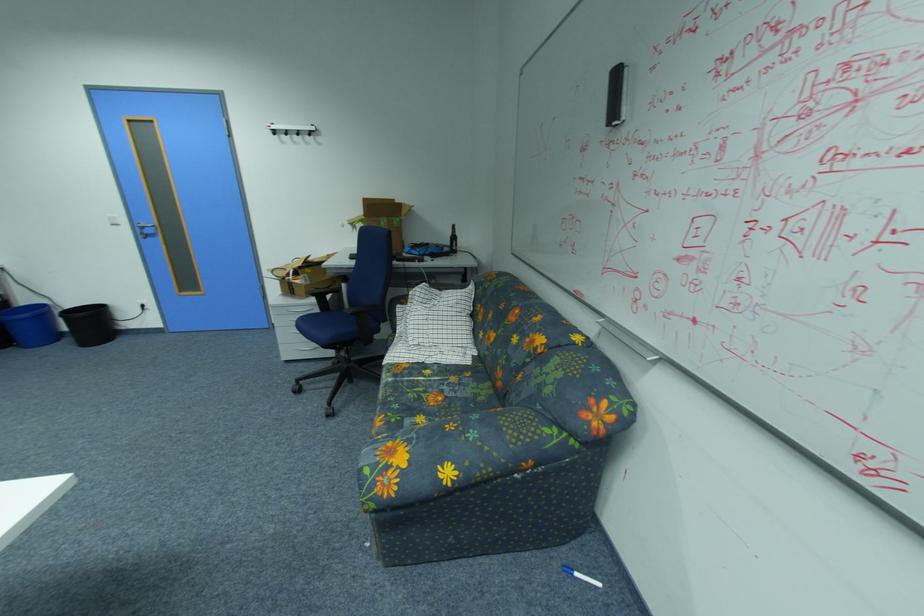
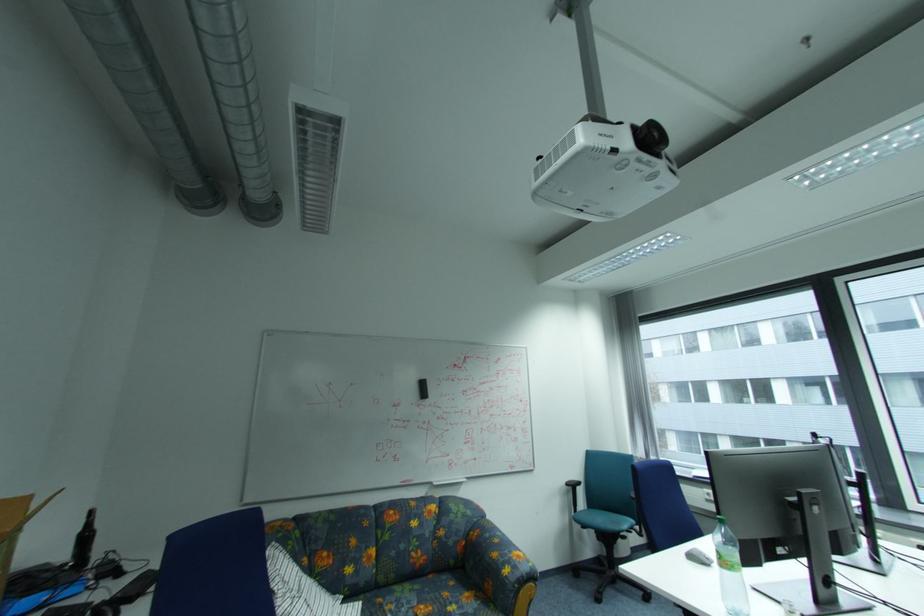
Where in the second image is the point corresponding to pixel 460 230 from the first image?

(93, 522)